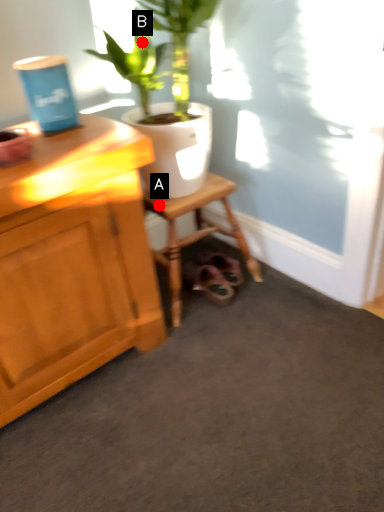
Question: Two points are circled on the image, labeled by A and B beside each circle. Which of the following is the closest to the observer?

Choices:
 (A) A is closer
 (B) B is closer

Answer: (B)